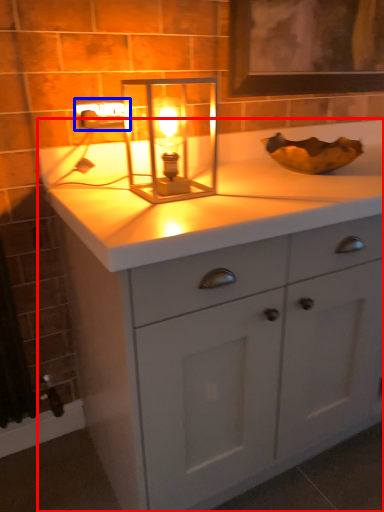
Question: Among these objects, which one is nearest to the camera, bathroom cabinet (highlighted by a red box) or electric outlet (highlighted by a blue box)?

Choices:
 (A) bathroom cabinet
 (B) electric outlet

Answer: (A)